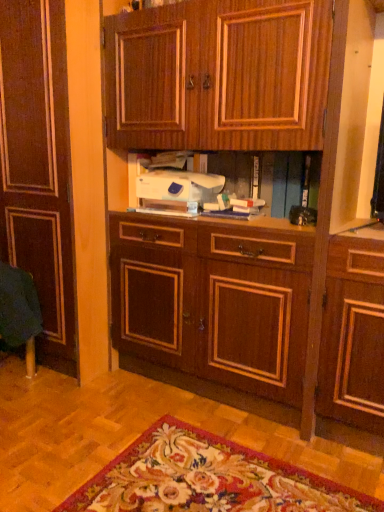
Describe the element at coordinates (177, 189) in the screenshot. I see `white plastic sewing machine at center` at that location.

This screenshot has height=512, width=384. Find the location of `white plastic sewing machine at center`. white plastic sewing machine at center is located at coordinates (177, 189).

Locate an element on the screen. Image resolution: width=384 pixels, height=512 pixels. white plastic sewing machine at center is located at coordinates (177, 189).